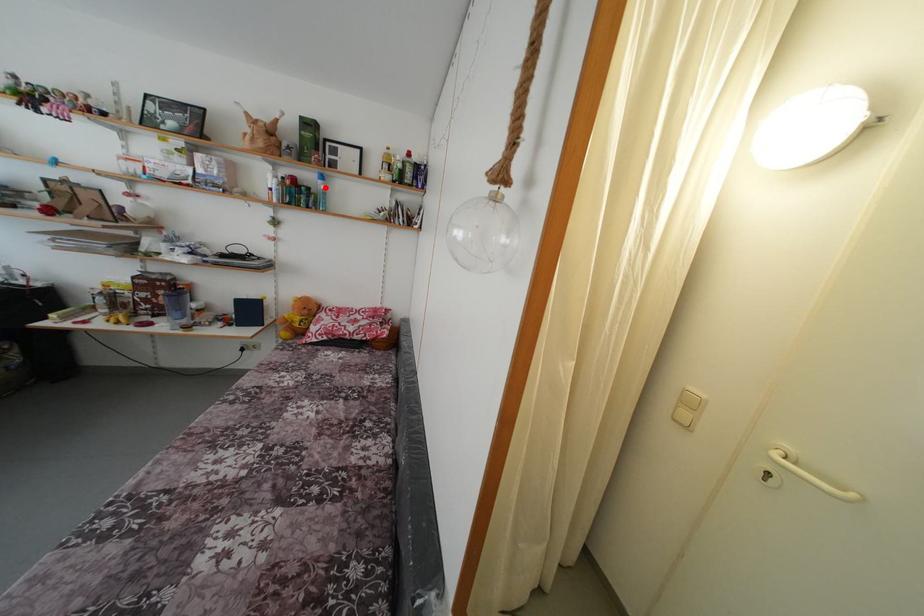
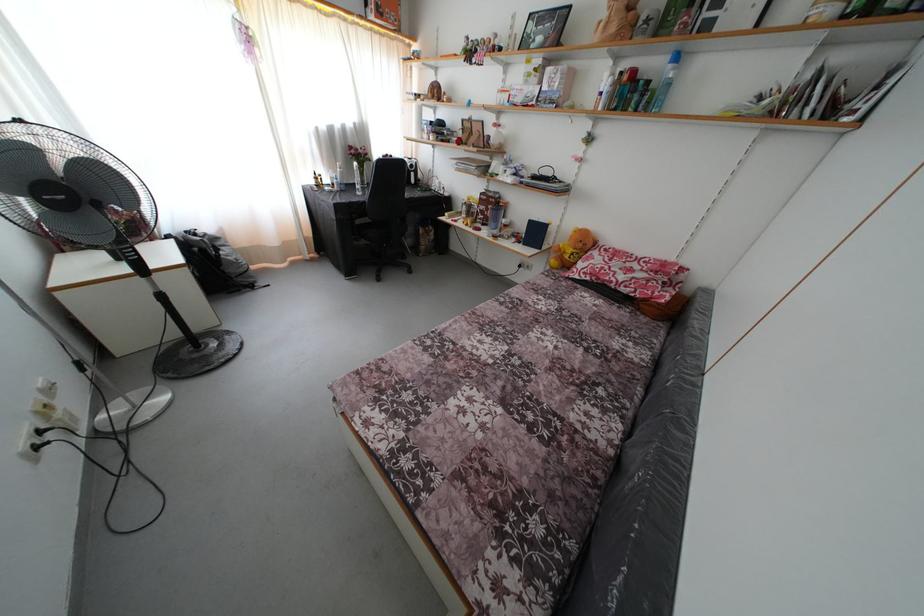
Question: I am providing you with two images of the same scene from different viewpoints. A red point is shown in image1. For the corresponding object point in image2, is it positioned nearer or farther from the camera?

Choices:
 (A) Nearer
 (B) Farther

Answer: (B)